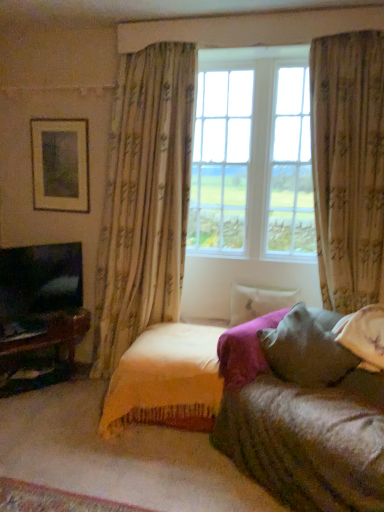
Question: From a real-world perspective, does white soft pillow at center, positioned as the first pillow in back-to-front order, stand above velvet yellow blanket at center?

Choices:
 (A) yes
 (B) no

Answer: (A)

Question: Does white soft pillow at center, the 2th pillow from the front, touch velvet yellow blanket at center?

Choices:
 (A) yes
 (B) no

Answer: (B)

Question: From the image's perspective, would you say white soft pillow at center, the 2th pillow from the front, is positioned over velvet yellow blanket at center?

Choices:
 (A) yes
 (B) no

Answer: (A)

Question: Is white soft pillow at center, the 2th pillow from the front, positioned before velvet yellow blanket at center?

Choices:
 (A) yes
 (B) no

Answer: (B)

Question: Is white soft pillow at center, positioned as the first pillow in back-to-front order, surrounding velvet yellow blanket at center?

Choices:
 (A) yes
 (B) no

Answer: (B)

Question: From the image's perspective, would you say white soft pillow at center, the 2th pillow from the front, is shown under velvet yellow blanket at center?

Choices:
 (A) yes
 (B) no

Answer: (B)

Question: Is matte black tv at left positioned before matte gold picture frame at upper left?

Choices:
 (A) yes
 (B) no

Answer: (A)

Question: Is matte black tv at left not close to matte gold picture frame at upper left?

Choices:
 (A) yes
 (B) no

Answer: (B)

Question: Considering the relative sizes of matte black tv at left and matte gold picture frame at upper left in the image provided, is matte black tv at left thinner than matte gold picture frame at upper left?

Choices:
 (A) yes
 (B) no

Answer: (B)

Question: Is matte black tv at left taller than matte gold picture frame at upper left?

Choices:
 (A) no
 (B) yes

Answer: (A)

Question: From the image's perspective, does matte black tv at left appear lower than matte gold picture frame at upper left?

Choices:
 (A) no
 (B) yes

Answer: (B)

Question: From the image's perspective, does matte black tv at left appear higher than matte gold picture frame at upper left?

Choices:
 (A) no
 (B) yes

Answer: (A)

Question: Is floral fabric curtain at center, the second curtain positioned from the right, behind matte black tv at left?

Choices:
 (A) yes
 (B) no

Answer: (B)